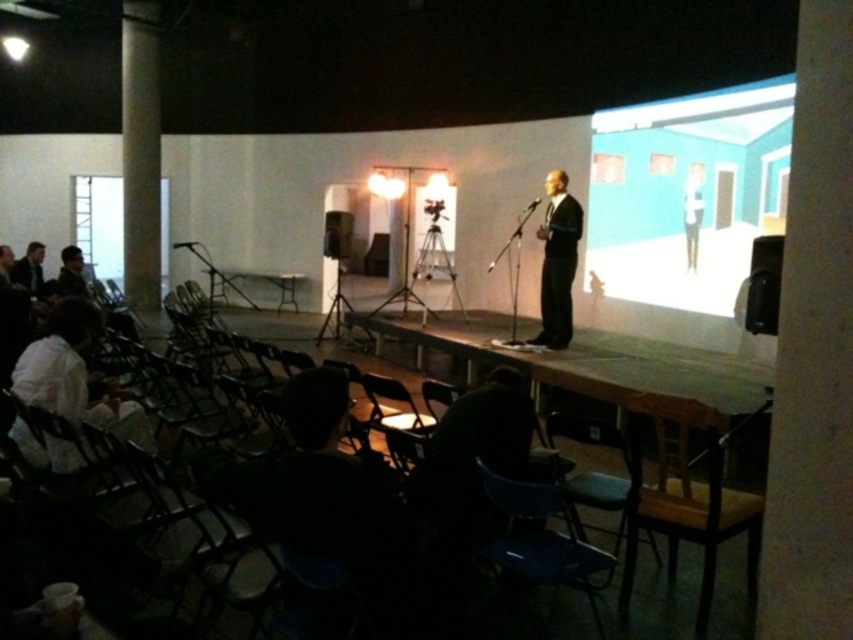
Can you confirm if blue plastic chair at lower center is positioned to the left of matte black speaker at center?

In fact, blue plastic chair at lower center is to the right of matte black speaker at center.

Between point (616, 476) and point (325, 240), which one is positioned behind?

The point (325, 240) is more distant.

The height and width of the screenshot is (640, 853). Find the location of `blue plastic chair at lower center`. blue plastic chair at lower center is located at coordinates (599, 493).

Does teal matte painting at upper right have a larger size compared to wooden chair at lower right?

Indeed, teal matte painting at upper right has a larger size compared to wooden chair at lower right.

The height and width of the screenshot is (640, 853). Find the location of `teal matte painting at upper right`. teal matte painting at upper right is located at coordinates (686, 195).

Is matte black speaker at center bigger than matte black chair at lower center?

Yes.

Is point (323, 252) behind point (440, 381)?

Yes, point (323, 252) is farther from viewer.

Is point (329, 209) less distant than point (437, 403)?

No, it is not.

Locate an element on the screen. The height and width of the screenshot is (640, 853). matte black speaker at center is located at coordinates (337, 234).